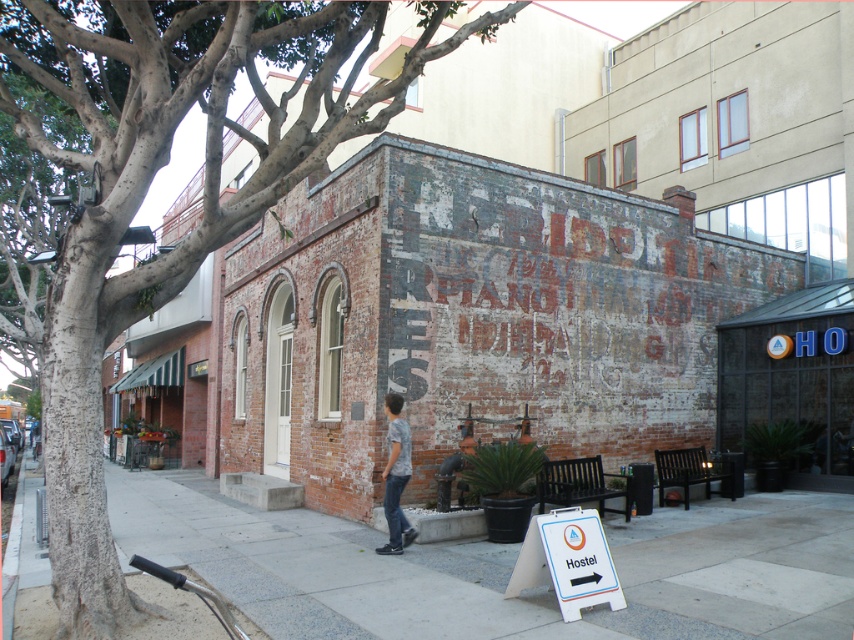
Question: Among these points, which one is farthest from the camera?

Choices:
 (A) (717, 536)
 (B) (846, 392)
 (C) (344, 112)

Answer: (B)

Question: Does white plastic sign at lower right come in front of camouflage shirt at center?

Choices:
 (A) no
 (B) yes

Answer: (B)

Question: Observing the image, what is the correct spatial positioning of smooth bark tree at left in reference to white plastic sign at lower right?

Choices:
 (A) right
 (B) left

Answer: (B)

Question: Is white plastic sign at lower right bigger than camouflage shirt at center?

Choices:
 (A) no
 (B) yes

Answer: (B)

Question: Which of these objects is positioned farthest from the gray concrete sidewalk at center?

Choices:
 (A) white plastic sign at lower right
 (B) camouflage shirt at center
 (C) smooth bark tree at left

Answer: (C)

Question: Among these objects, which one is nearest to the camera?

Choices:
 (A) gray concrete sidewalk at center
 (B) white plastic sign at lower right

Answer: (A)